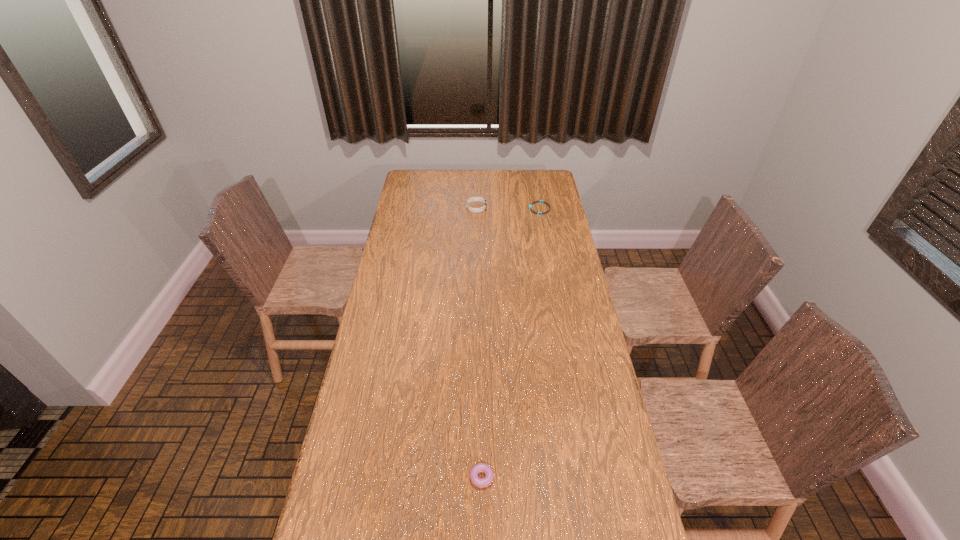
Locate an element on the screen. The width and height of the screenshot is (960, 540). the tallest object is located at coordinates (475, 210).

I want to click on the left wristband, so click(x=475, y=210).

Where is `doughnut`? Image resolution: width=960 pixels, height=540 pixels. doughnut is located at coordinates (480, 467).

At what (x,y) coordinates should I click in order to perform the action: click on the nearest object. Please return your answer as a coordinate pair (x, y). This screenshot has height=540, width=960. Looking at the image, I should click on (480, 467).

Where is `the shortest object`? The height and width of the screenshot is (540, 960). the shortest object is located at coordinates (540, 201).

This screenshot has height=540, width=960. What are the coordinates of `the shorter wristband` in the screenshot? It's located at (540, 201).

Identify the location of vacant space situated 0.120m on the outer surface of the tallest object. (510, 208).

This screenshot has width=960, height=540. Identify the location of vacant space situated 0.230m on the right of the second shortest object. (574, 475).

Identify the location of vacant area located on the buckle of the shortest object. The width and height of the screenshot is (960, 540). (453, 208).

Find the location of a particular element. vacant region located on the buckle of the shortest object is located at coordinates (467, 208).